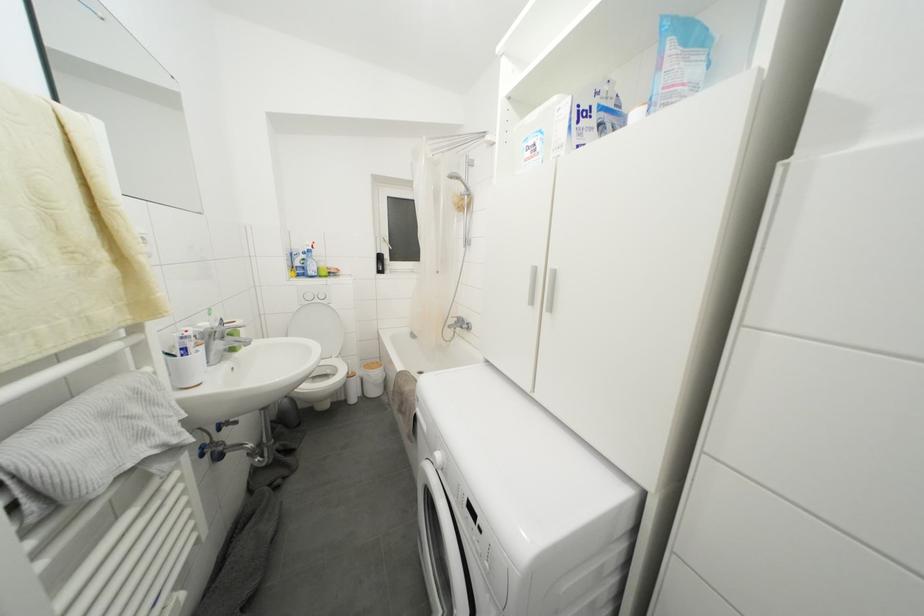
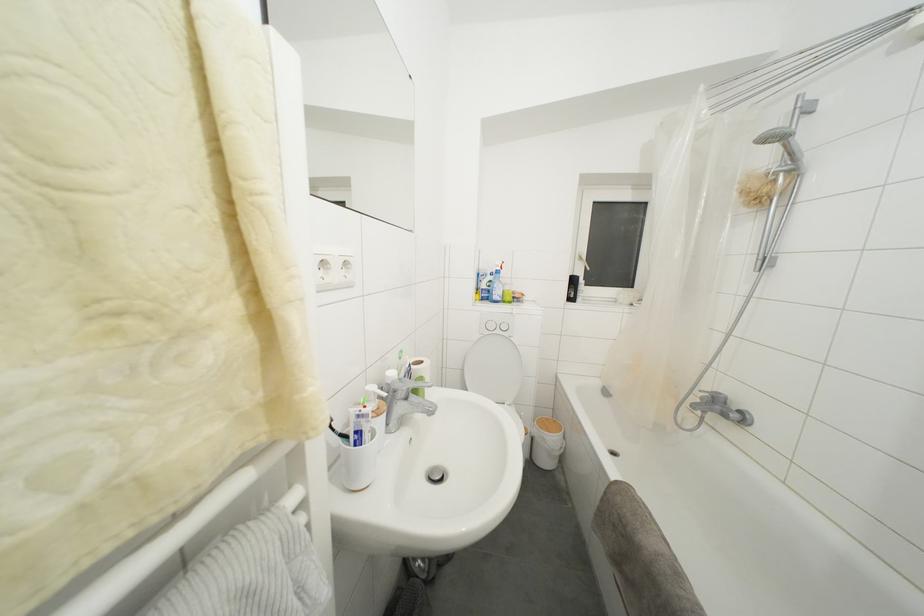
Question: How did the camera likely rotate?

Choices:
 (A) Left
 (B) Right
 (C) Up
 (D) Down

Answer: (A)